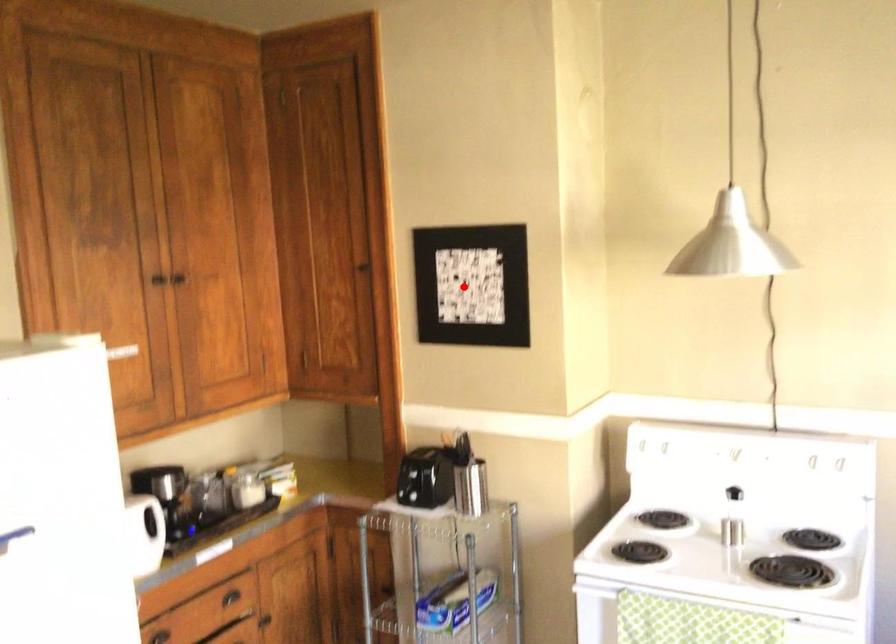
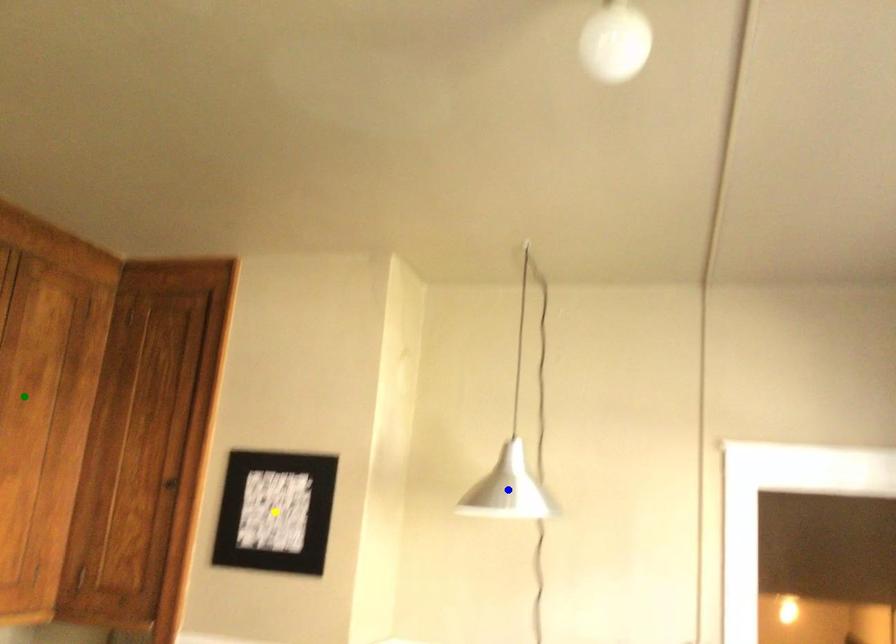
Question: I am providing you with two images of the same scene from different viewpoints. A red point is marked on the first image. You are given multiple points on the second image. Which point in image 2 is actually the same real-world point as the red point in image 1?

Choices:
 (A) blue point
 (B) yellow point
 (C) green point

Answer: (B)